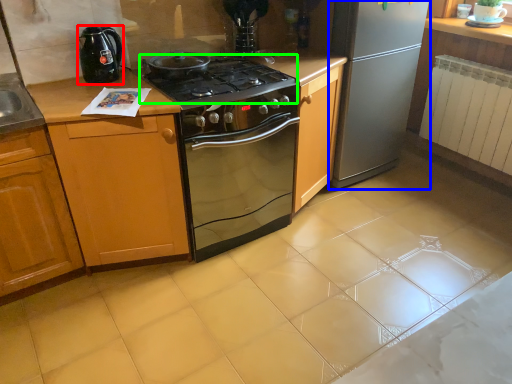
Question: Estimate the real-world distances between objects in this image. Which object is farther from kitchen appliance (highlighted by a red box), refrigerator (highlighted by a blue box) or gas stove (highlighted by a green box)?

Choices:
 (A) refrigerator
 (B) gas stove

Answer: (A)